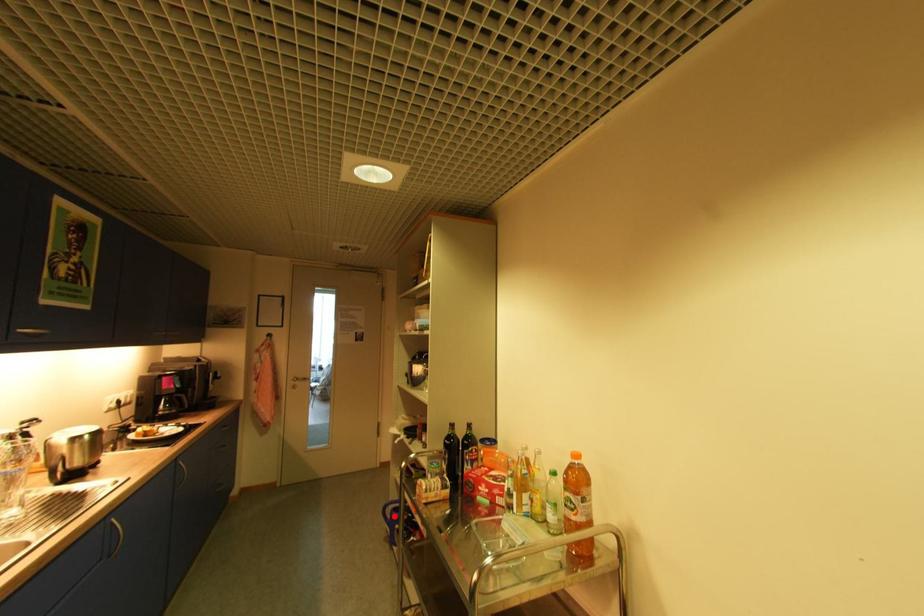
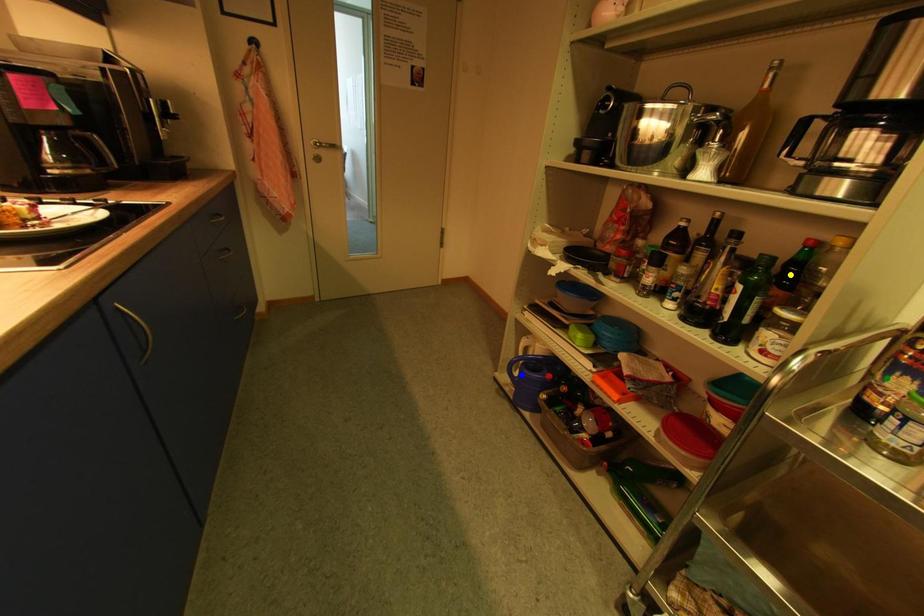
Question: I am providing you with two images of the same scene from different viewpoints. A red point is marked on the first image. You are given multiple points on the second image. Which point in image 2 represents the same 3d spot as the red point in image 1?

Choices:
 (A) yellow point
 (B) blue point
 (C) green point

Answer: (B)